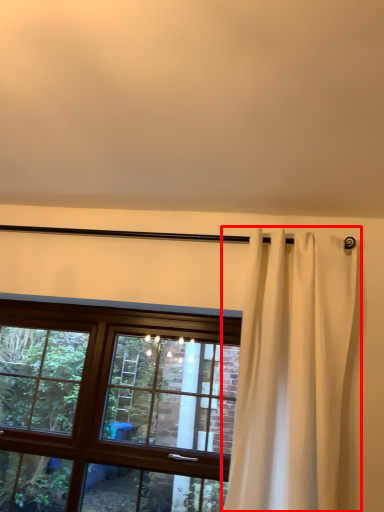
Question: From the image, what is the correct spatial relationship of curtain (annotated by the red box) in relation to window?

Choices:
 (A) right
 (B) left

Answer: (A)